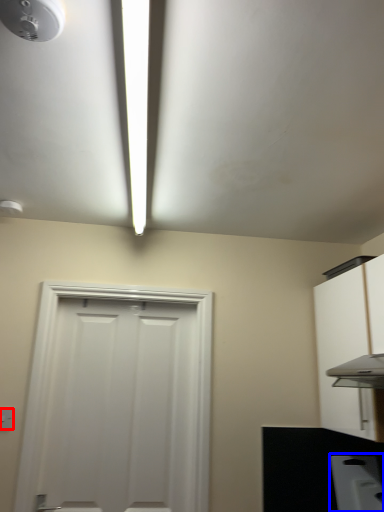
Question: Among these objects, which one is farthest to the camera, light switch (highlighted by a red box) or appliance (highlighted by a blue box)?

Choices:
 (A) light switch
 (B) appliance

Answer: (B)